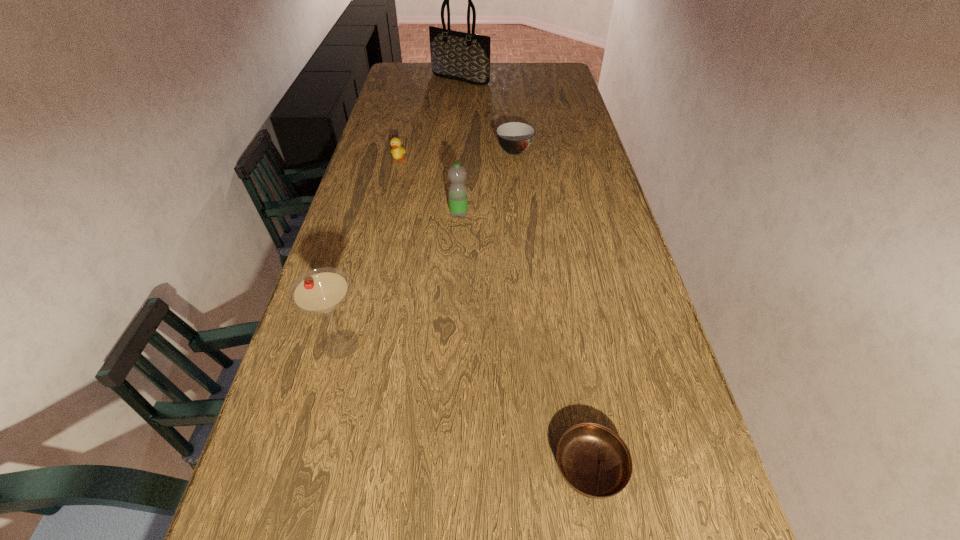
Image resolution: width=960 pixels, height=540 pixels. I want to click on vacant space that is in between the second nearest object and the farthest object, so click(x=400, y=212).

Image resolution: width=960 pixels, height=540 pixels. Find the location of `empty location between the martini and the tote bag`. empty location between the martini and the tote bag is located at coordinates (400, 212).

Image resolution: width=960 pixels, height=540 pixels. Find the location of `free space between the nearest object and the farthest object`. free space between the nearest object and the farthest object is located at coordinates (525, 273).

Identify which object is the nearest to the taller soup bowl. Please provide its 2D coordinates. Your answer should be formatted as a tuple, i.e. [(x, y)], where the tuple contains the x and y coordinates of a point satisfying the conditions above.

[(458, 202)]

At what (x,y) coordinates should I click in order to perform the action: click on object that is the fourth nearest to the second shortest object. Please return your answer as a coordinate pair (x, y). Image resolution: width=960 pixels, height=540 pixels. Looking at the image, I should click on (320, 291).

The height and width of the screenshot is (540, 960). I want to click on vacant space that satisfies the following two spatial constraints: 1. on the front-facing side of the water bottle; 2. on the left side of the duckling, so click(386, 214).

Where is `free space that satisfies the following two spatial constraints: 1. on the front-facing side of the duckling; 2. on the left side of the third nearest object`? The image size is (960, 540). free space that satisfies the following two spatial constraints: 1. on the front-facing side of the duckling; 2. on the left side of the third nearest object is located at coordinates (386, 214).

At what (x,y) coordinates should I click in order to perform the action: click on free space that satisfies the following two spatial constraints: 1. on the front side of the shorter soup bowl; 2. on the left side of the tote bag. Please return your answer as a coordinate pair (x, y). Image resolution: width=960 pixels, height=540 pixels. Looking at the image, I should click on (431, 468).

At what (x,y) coordinates should I click in order to perform the action: click on free point that satisfies the following two spatial constraints: 1. on the front-facing side of the shorter soup bowl; 2. on the right side of the duckling. Please return your answer as a coordinate pair (x, y). Looking at the image, I should click on (325, 468).